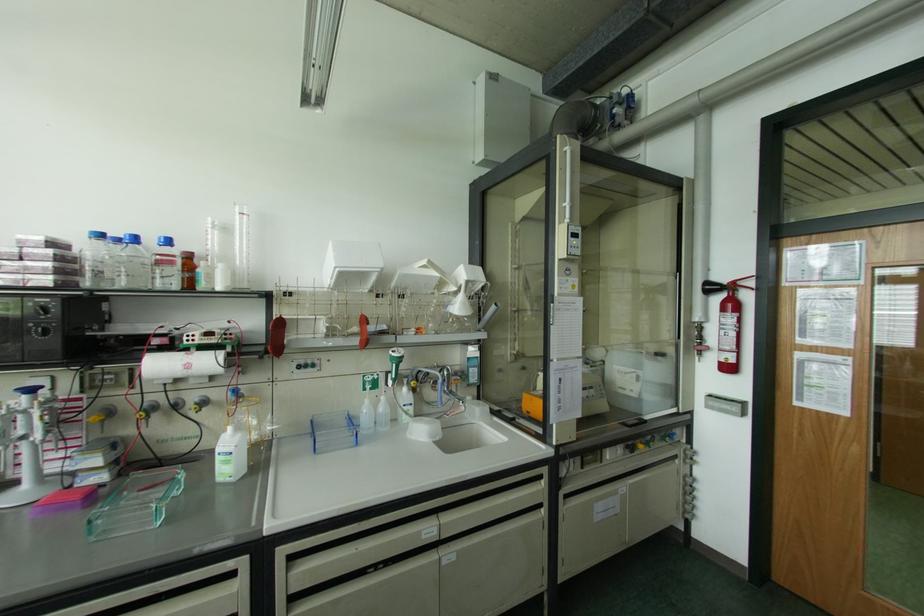
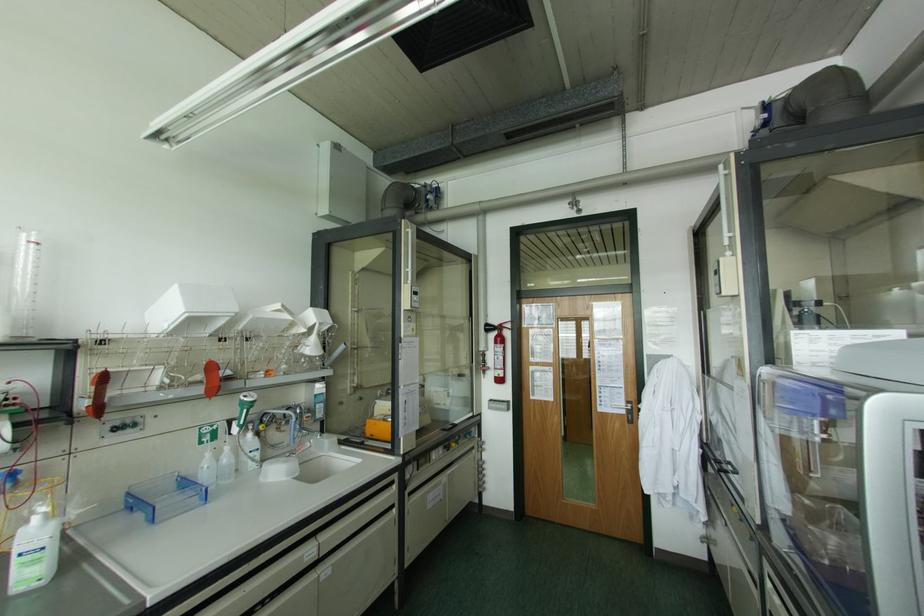
Locate, in the second image, the point that corresponds to [382,398] in the first image.

(226, 448)